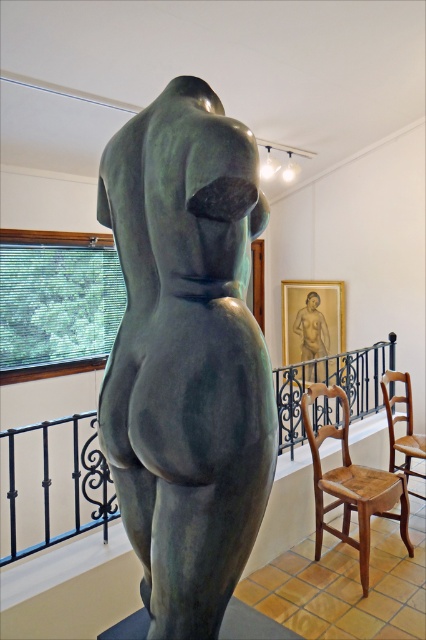
Question: Does bronze statue at center come behind dark green metal balustrade at center?

Choices:
 (A) no
 (B) yes

Answer: (A)

Question: Among these objects, which one is nearest to the camera?

Choices:
 (A) wooden chair at right
 (B) dark green metal balustrade at center
 (C) matte bronze statue at center

Answer: (B)

Question: Which of these objects is positioned closest to the wooden chair at right?

Choices:
 (A) matte bronze statue at center
 (B) wooden chair at lower right
 (C) dark green metal balustrade at center

Answer: (C)

Question: Does bronze statue at center have a lesser width compared to wooden chair at right?

Choices:
 (A) yes
 (B) no

Answer: (B)

Question: Estimate the real-world distances between objects in this image. Which object is farther from the wooden chair at lower right?

Choices:
 (A) bronze statue at center
 (B) matte bronze statue at center

Answer: (B)

Question: Does bronze statue at center have a greater width compared to dark green metal balustrade at center?

Choices:
 (A) yes
 (B) no

Answer: (B)